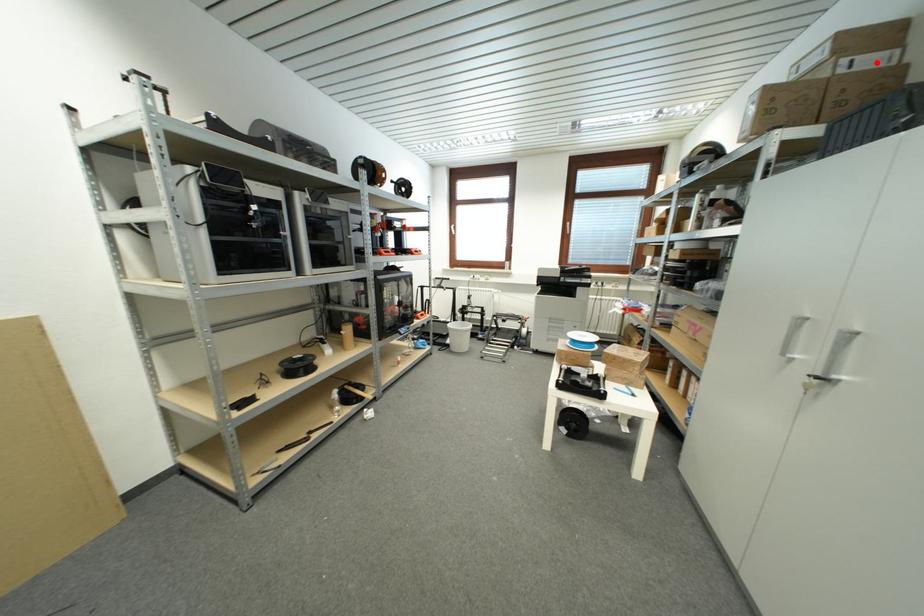
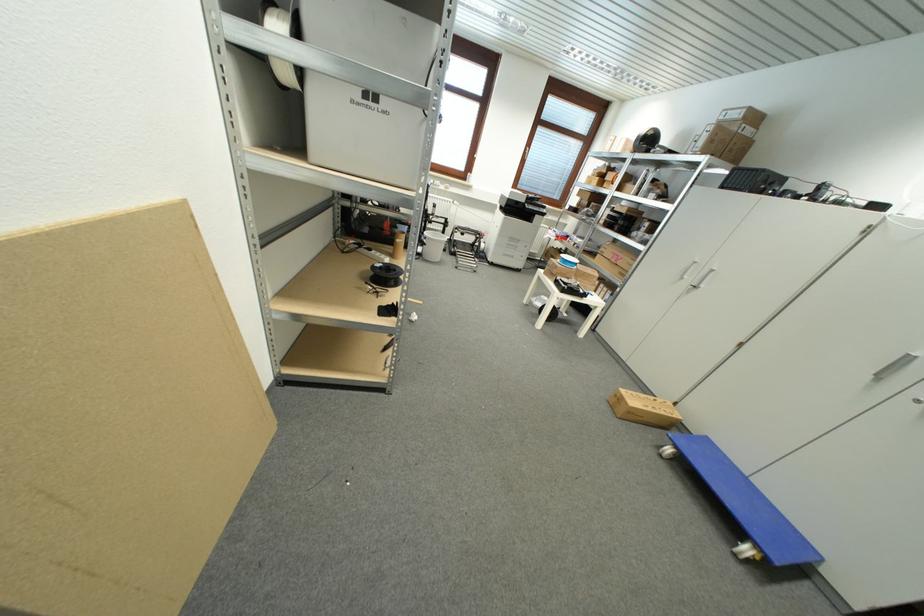
Question: I am providing you with two images of the same scene from different viewpoints. A red point is shown in image1. For the corresponding object point in image2, is it positioned nearer or farther from the camera?

Choices:
 (A) Nearer
 (B) Farther

Answer: (B)